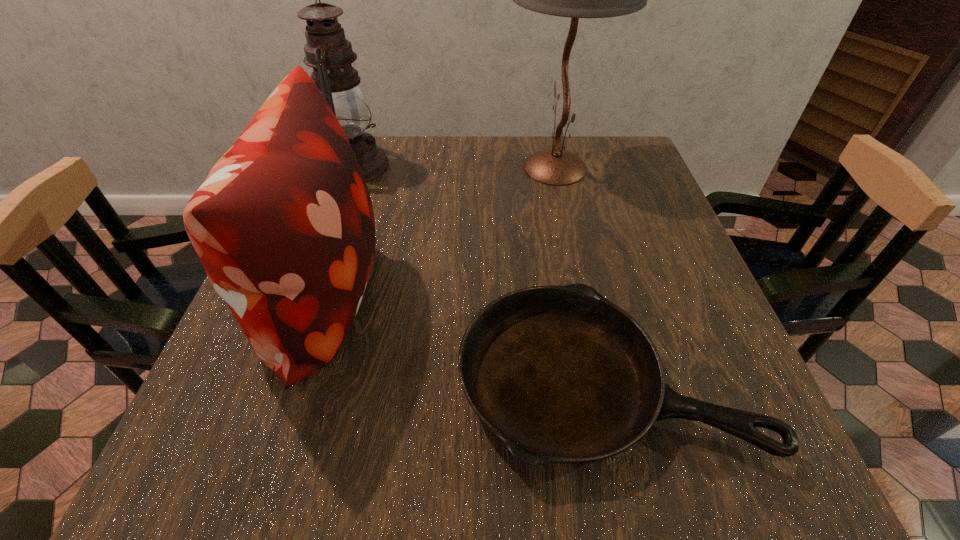
The image size is (960, 540). Find the location of `table lamp located at the far edge`. table lamp located at the far edge is located at coordinates (558, 167).

The width and height of the screenshot is (960, 540). I want to click on oil lamp that is at the far edge, so click(328, 52).

You are a GUI agent. You are given a task and a screenshot of the screen. Output one action in this format:
    pyautogui.click(x=<x>, y=<y>)
    Task: Click on the object located at the near edge
    
    Given the screenshot: What is the action you would take?
    pyautogui.click(x=560, y=374)

You are a GUI agent. You are given a task and a screenshot of the screen. Output one action in this format:
    pyautogui.click(x=<x>, y=<y>)
    Task: Click on the oil lamp located in the left edge section of the desktop
    
    Given the screenshot: What is the action you would take?
    click(328, 52)

Where is `cushion present at the left edge`? cushion present at the left edge is located at coordinates (283, 224).

Find the location of a particular element. table lamp located at the right edge is located at coordinates (558, 167).

Image resolution: width=960 pixels, height=540 pixels. I want to click on frying pan that is at the right edge, so click(x=560, y=374).

At what (x,y) coordinates should I click in order to perform the action: click on object situated at the far left corner. Please return your answer as a coordinate pair (x, y). Image resolution: width=960 pixels, height=540 pixels. Looking at the image, I should click on (328, 52).

I want to click on object present at the far right corner, so click(x=558, y=167).

Identify the location of object at the near right corner. (560, 374).